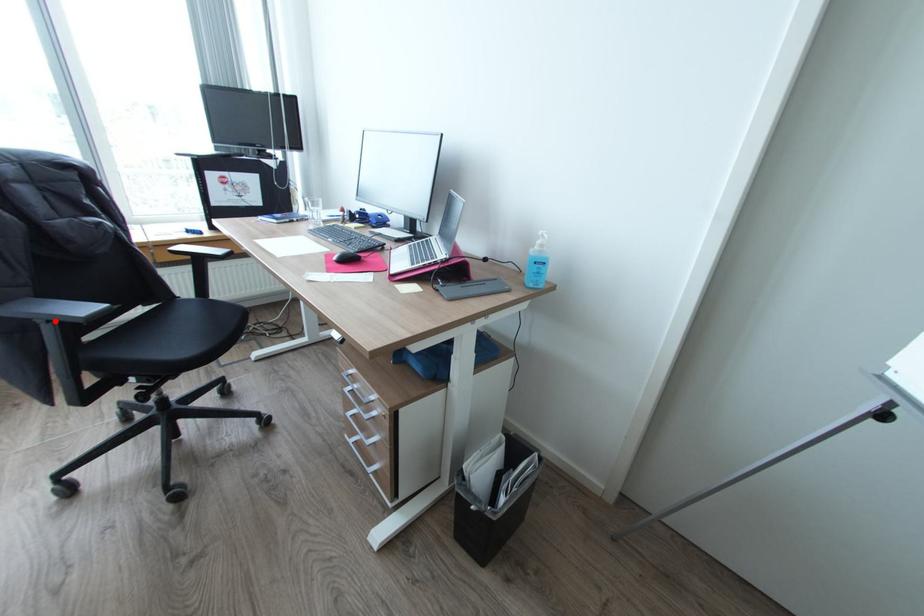
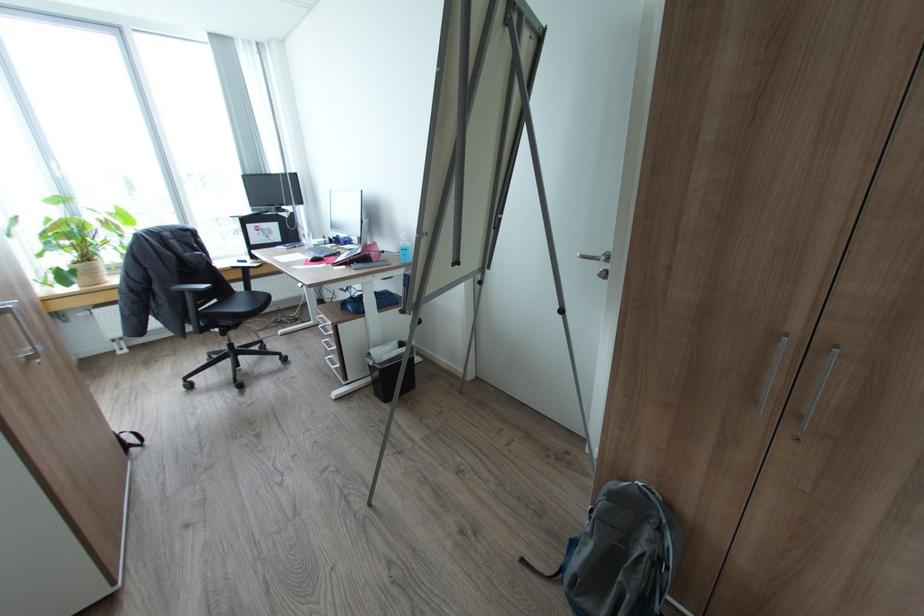
Locate, in the second image, the point that corresponds to the highlighted location in the first image.

(195, 292)